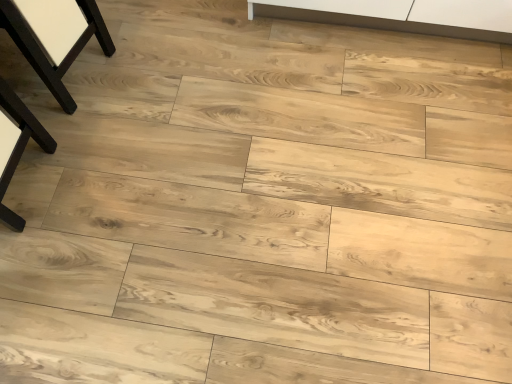
Image resolution: width=512 pixels, height=384 pixels. Find the location of `matte wood table at upper left`. matte wood table at upper left is located at coordinates (44, 55).

Describe the element at coordinates (44, 55) in the screenshot. I see `matte wood table at upper left` at that location.

You are a GUI agent. You are given a task and a screenshot of the screen. Output one action in this format:
    pyautogui.click(x=<x>, y=<y>)
    Task: Click on the matte wood table at upper left
    The width and height of the screenshot is (512, 384).
    Given the screenshot: What is the action you would take?
    [44, 55]